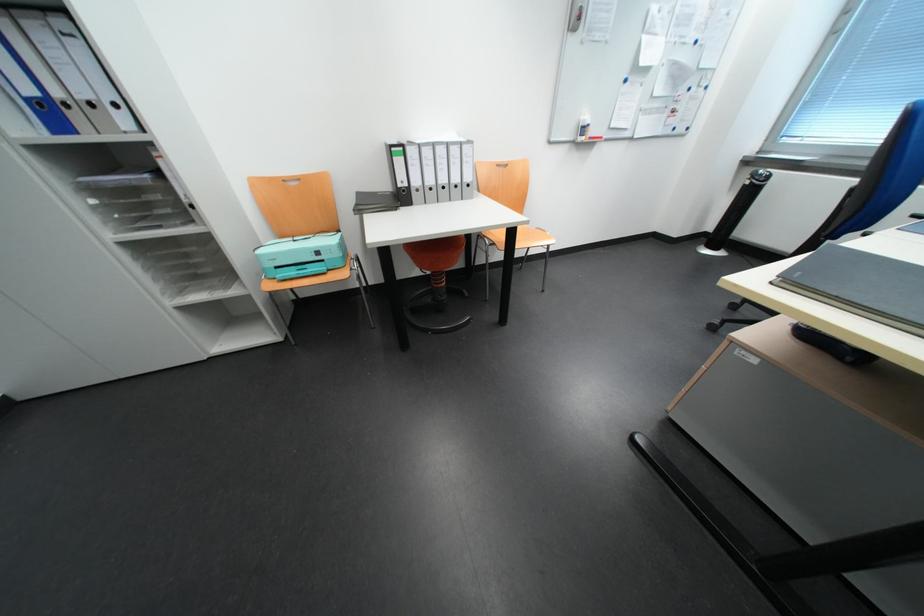
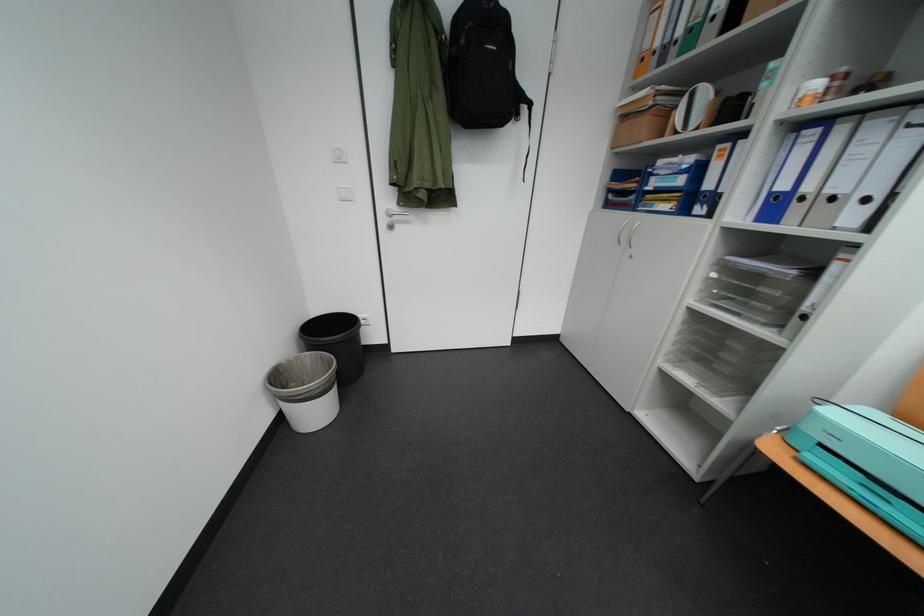
In the second image, find the point that corresponds to the point at 287,269 in the first image.

(833, 447)